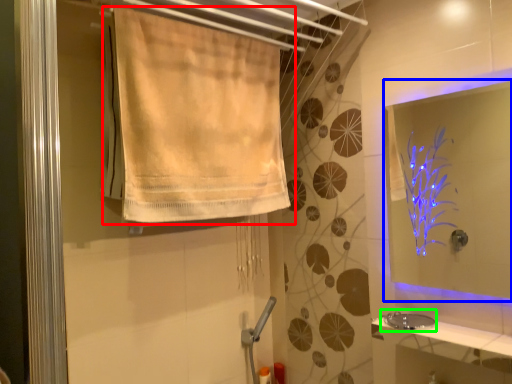
Question: Which object is positioned farthest from curtain (highlighted by a red box)? Select from mirror (highlighted by a blue box) and sink (highlighted by a green box).

Choices:
 (A) mirror
 (B) sink

Answer: (A)